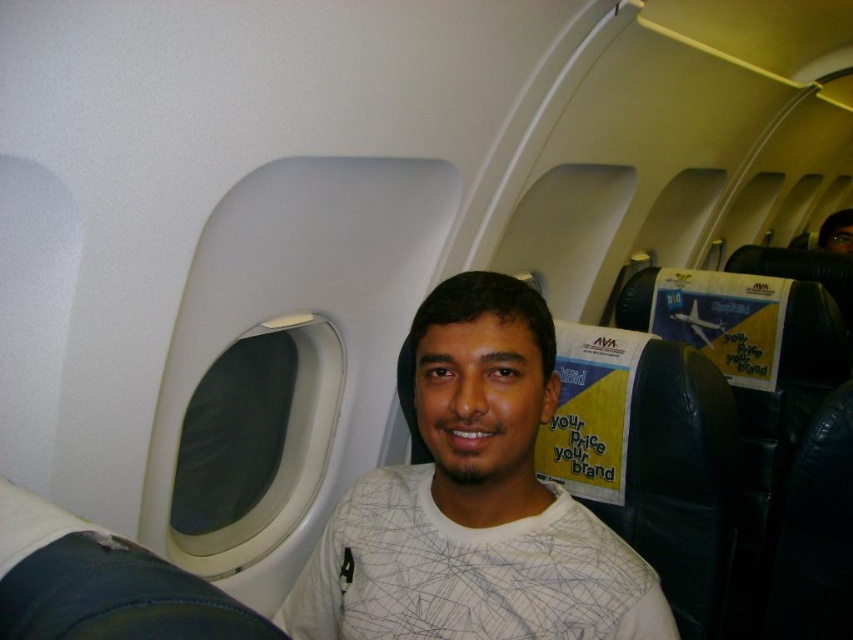
Which of these two, white matte shirt at center or denim at left, stands shorter?

denim at left

Which is more to the right, white matte shirt at center or denim at left?

Positioned to the right is white matte shirt at center.

Who is more forward, (451, 593) or (86, 630)?

Point (86, 630) is in front.

The image size is (853, 640). What are the coordinates of `white matte shirt at center` in the screenshot? It's located at (474, 502).

Is white matte shirt at center above metallic airplane at upper right?

Incorrect, white matte shirt at center is not positioned above metallic airplane at upper right.

Which is above, white matte shirt at center or metallic airplane at upper right?

metallic airplane at upper right

The width and height of the screenshot is (853, 640). Describe the element at coordinates (474, 502) in the screenshot. I see `white matte shirt at center` at that location.

The image size is (853, 640). Find the location of `white matte shirt at center`. white matte shirt at center is located at coordinates (474, 502).

Does denim at left come behind metallic airplane at upper right?

That is False.

Which of these two, denim at left or metallic airplane at upper right, stands taller?

With more height is metallic airplane at upper right.

What do you see at coordinates (102, 582) in the screenshot? I see `denim at left` at bounding box center [102, 582].

I want to click on denim at left, so click(102, 582).